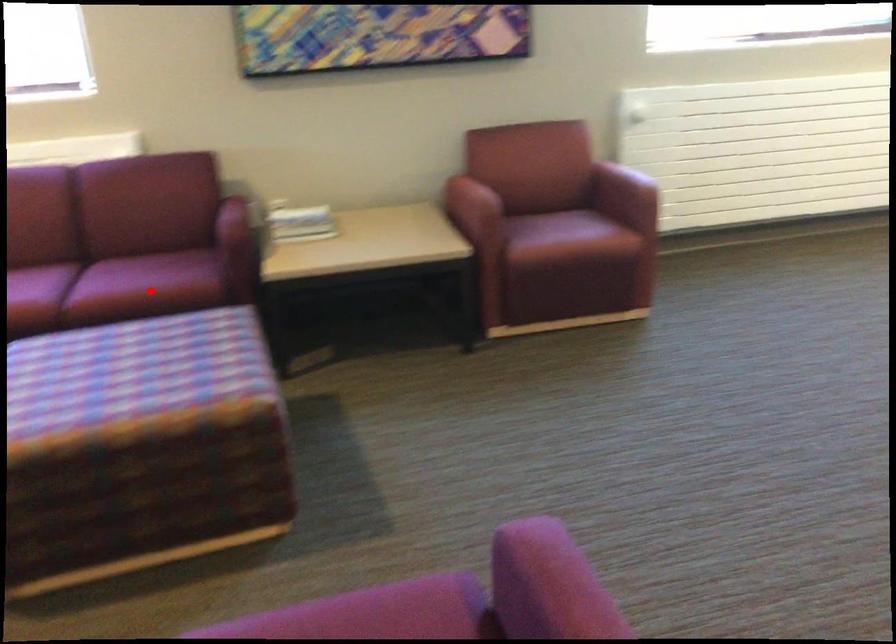
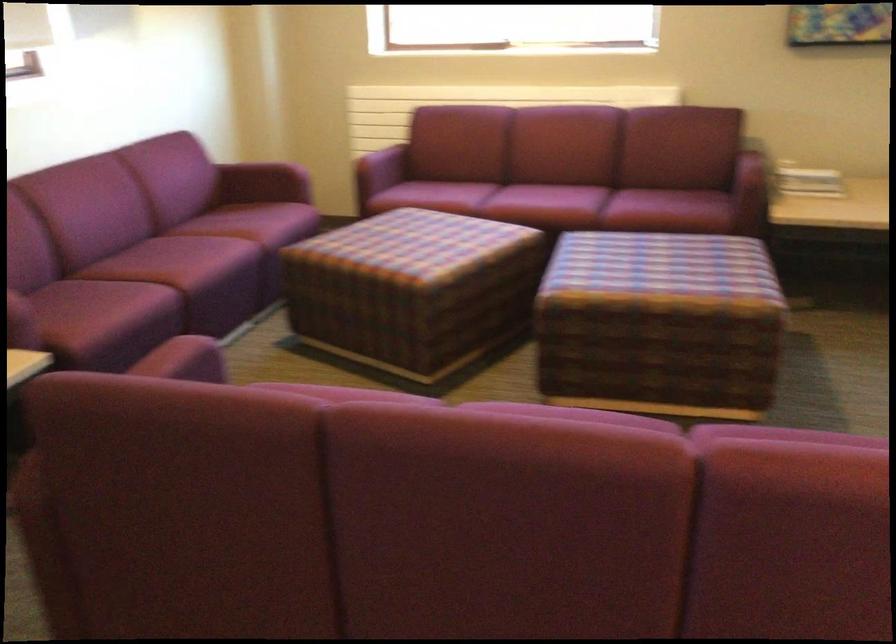
Find the pixel in the second image that matches the highlighted location in the first image.

(668, 211)